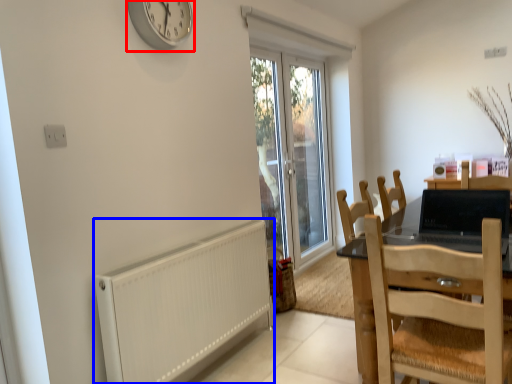
Question: Which of the following is the closest to the observer, clock (highlighted by a red box) or radiator (highlighted by a blue box)?

Choices:
 (A) clock
 (B) radiator

Answer: (B)